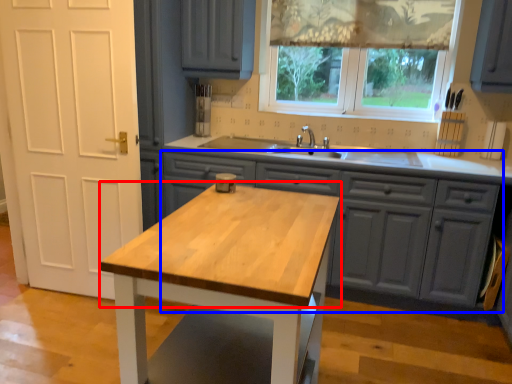
Question: Which point is further to the camera, countertop (highlighted by a red box) or cabinetry (highlighted by a blue box)?

Choices:
 (A) countertop
 (B) cabinetry

Answer: (B)